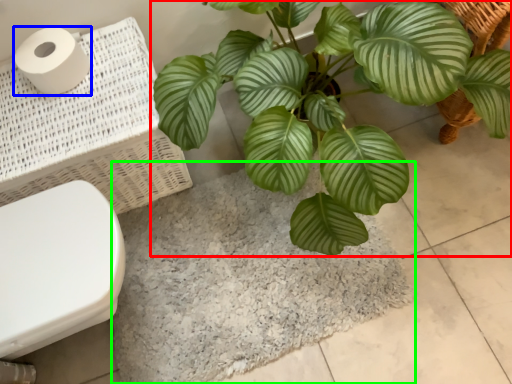
Question: Based on their relative distances, which object is nearer to houseplant (highlighted by a red box)? Choose from toilet paper (highlighted by a blue box) and bath mat (highlighted by a green box).

Choices:
 (A) toilet paper
 (B) bath mat

Answer: (B)